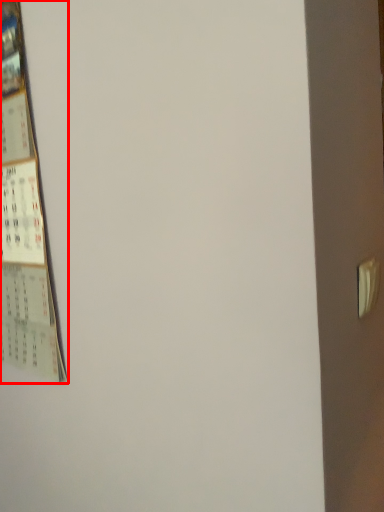
Question: Where is poster (annotated by the red box) located in relation to door handle in the image?

Choices:
 (A) right
 (B) left

Answer: (B)